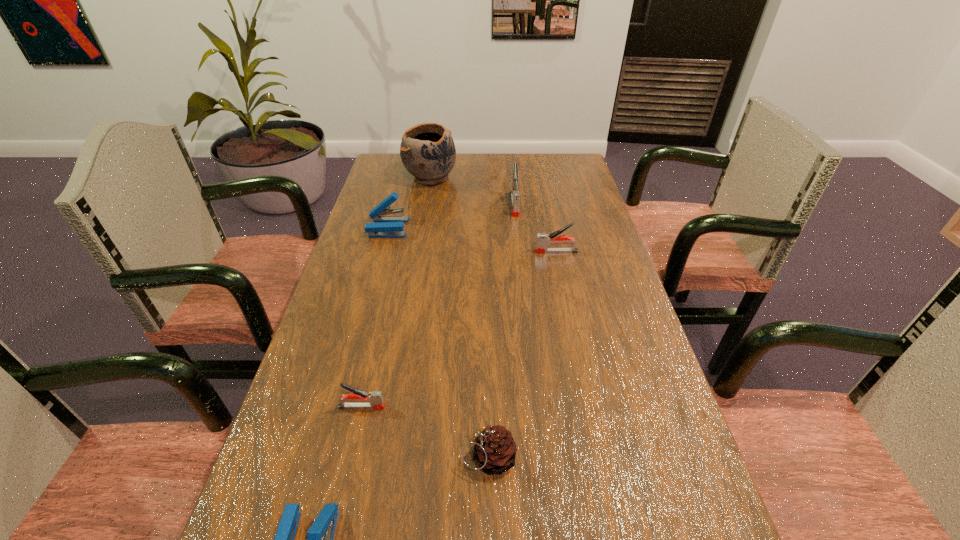
I want to click on empty location between the bigger blue stapler and the third nearest stapler, so click(x=472, y=240).

Where is `vacant area that lies between the second nearest object and the leftmost gray stapler`? vacant area that lies between the second nearest object and the leftmost gray stapler is located at coordinates (425, 432).

In order to click on free space between the rightmost gray stapler and the third farthest object in this screenshot , I will do `click(472, 240)`.

At what (x,y) coordinates should I click in order to perform the action: click on vacant area that lies between the farther blue stapler and the leftmost gray stapler. Please return your answer as a coordinate pair (x, y). This screenshot has height=540, width=960. Looking at the image, I should click on (375, 317).

You are a GUI agent. You are given a task and a screenshot of the screen. Output one action in this format:
    pyautogui.click(x=<x>, y=<y>)
    Task: Click on the free space between the farther blue stapler and the pinecone
    The height and width of the screenshot is (540, 960).
    Given the screenshot: What is the action you would take?
    pyautogui.click(x=439, y=342)

The image size is (960, 540). I want to click on object that stands as the sixth closest to the pottery, so click(x=320, y=535).

At what (x,y) coordinates should I click in order to perform the action: click on object identified as the fourth closest to the fourth stapler from left to right. Please return your answer as a coordinate pair (x, y). Image resolution: width=960 pixels, height=540 pixels. Looking at the image, I should click on (375, 398).

The image size is (960, 540). I want to click on stapler that stands as the fourth closest to the bigger blue stapler, so 320,535.

Locate which stapler ranks in proximity to the second nearest object. Please provide its 2D coordinates. Your answer should be formatted as a tuple, i.e. [(x, y)], where the tuple contains the x and y coordinates of a point satisfying the conditions above.

[(375, 398)]

What are the coordinates of `gray stapler identified as the second closest to the nearest stapler` in the screenshot? It's located at (543, 240).